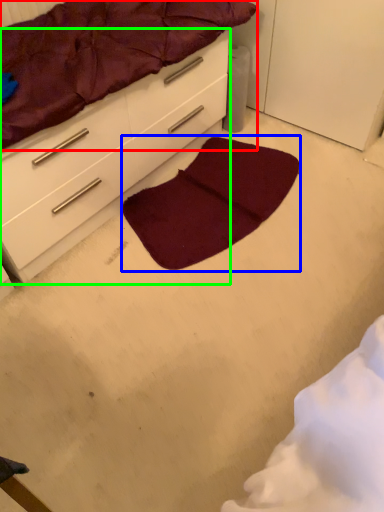
Question: Which object is the closest to the mattress (highlighted by a red box)? Choose among these: mat (highlighted by a blue box) or chest of drawers (highlighted by a green box).

Choices:
 (A) mat
 (B) chest of drawers

Answer: (B)